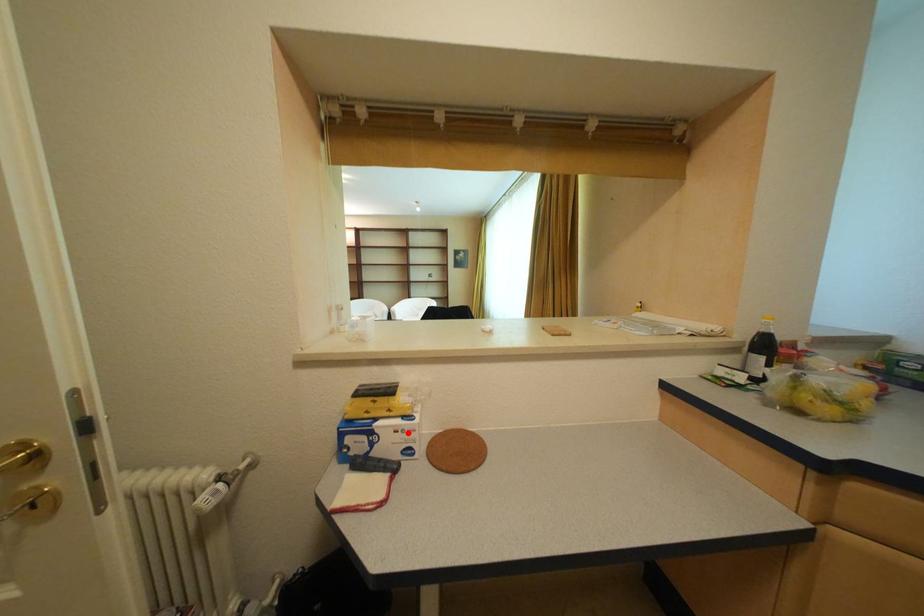
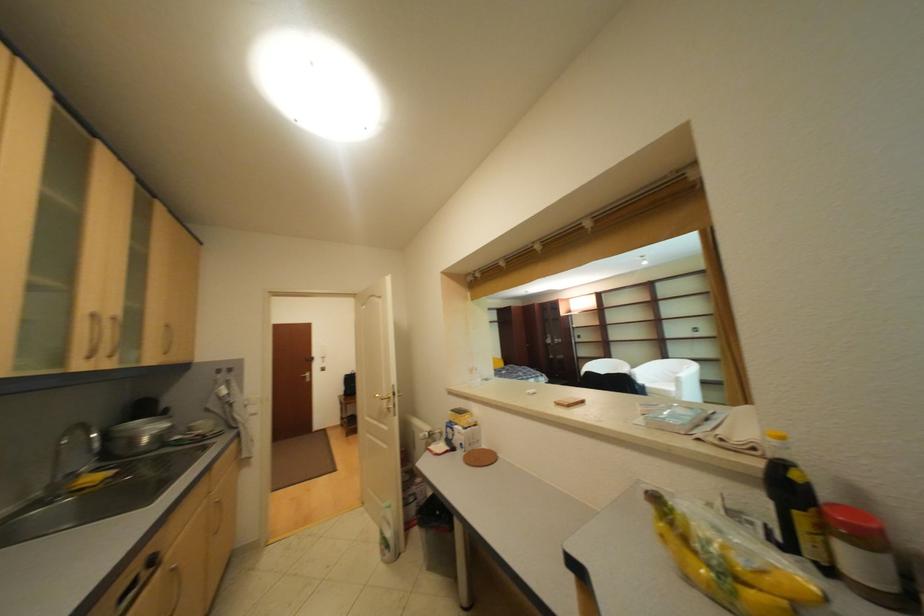
Question: I am providing you with two images of the same scene from different viewpoints. Given a red point in image1, look at the same physical point in image2. Is it:

Choices:
 (A) Closer to the viewpoint
 (B) Farther from the viewpoint

Answer: (B)